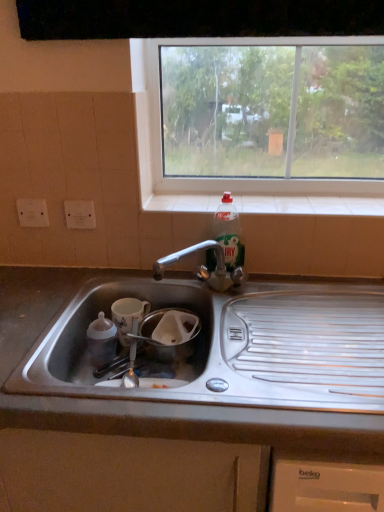
Question: From a real-world perspective, is translucent plastic bottle at upper right positioned above or below satin steel sink at lower center?

Choices:
 (A) above
 (B) below

Answer: (A)

Question: Looking at their shapes, would you say translucent plastic bottle at upper right is wider or thinner than satin steel sink at lower center?

Choices:
 (A) thin
 (B) wide

Answer: (A)

Question: Which of these objects is positioned farthest from the white tile at upper center?

Choices:
 (A) white glossy mug at lower left
 (B) translucent plastic bottle at upper right
 (C) clear glass window at upper center
 (D) satin steel sink at lower center

Answer: (D)

Question: Based on their relative distances, which object is farther from the clear glass window at upper center?

Choices:
 (A) white glossy mug at lower left
 (B) satin steel sink at lower center
 (C) translucent plastic bottle at upper right
 (D) white tile at upper center

Answer: (B)